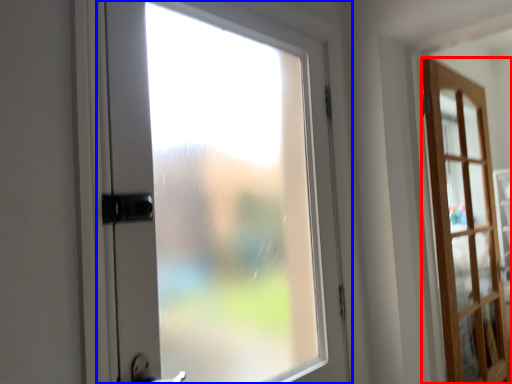
Question: Which object appears closest to the camera in this image, door (highlighted by a red box) or door (highlighted by a blue box)?

Choices:
 (A) door
 (B) door

Answer: (B)